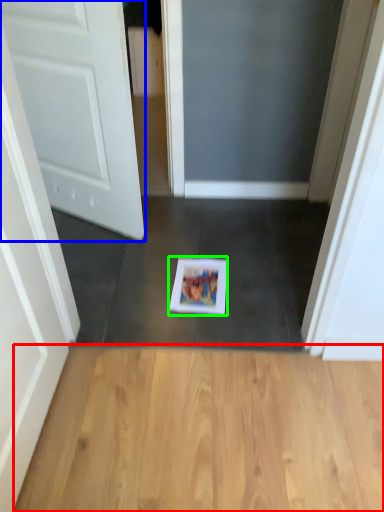
Question: Considering the real-world distances, which object is farthest from hardwood (highlighted by a red box)? door (highlighted by a blue box) or copy (highlighted by a green box)?

Choices:
 (A) door
 (B) copy

Answer: (A)